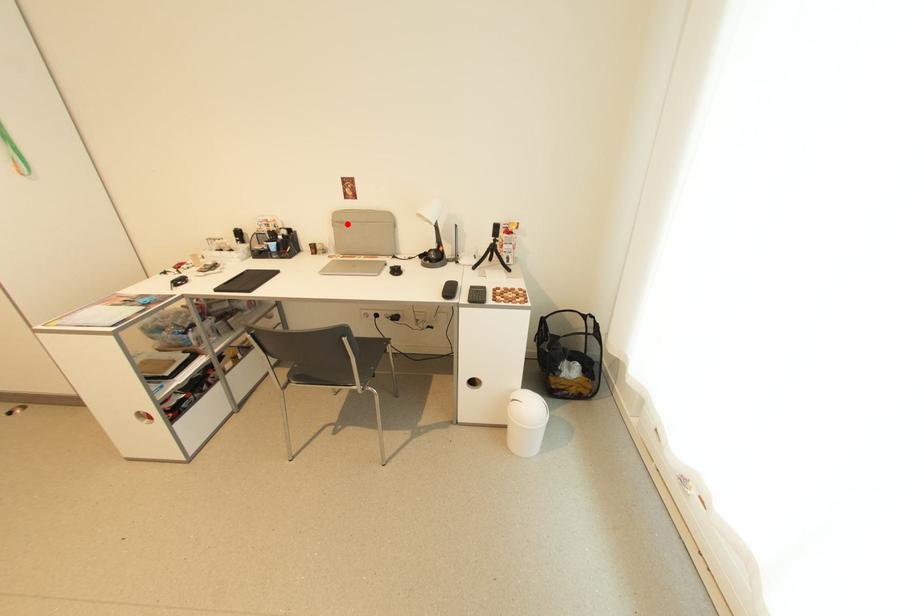
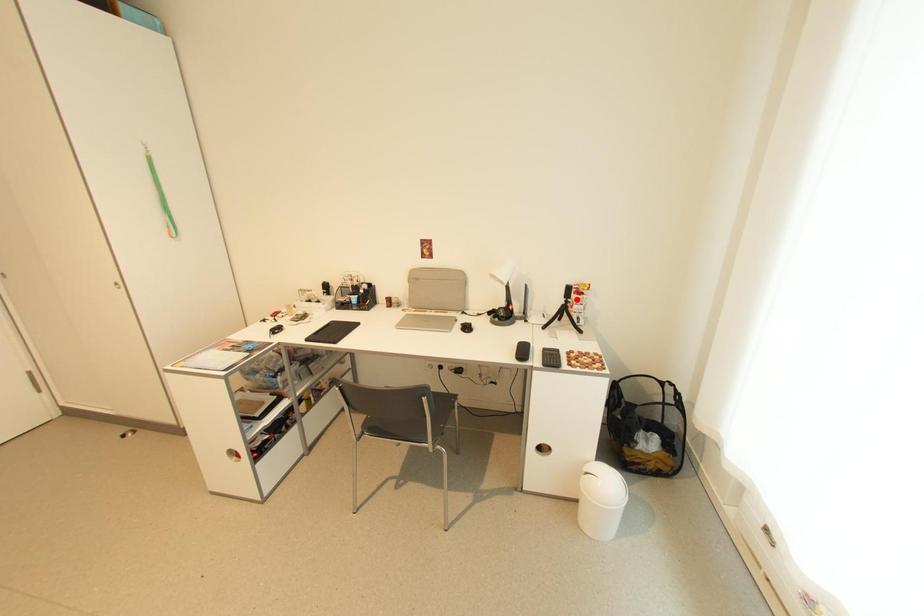
In the scene shown: I am providing you with two images of the same scene from different viewpoints. A red point is marked on the first image and another point is marked on the second image. Is the marked point in image1 the same physical position as the marked point in image2?

No